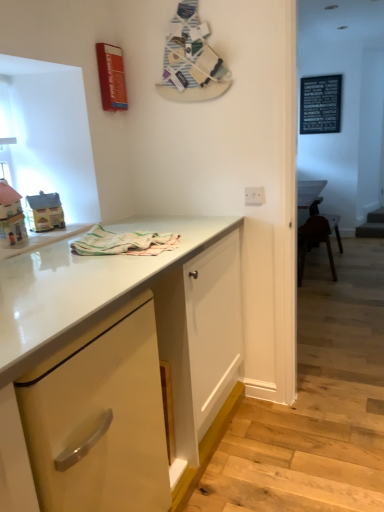
Question: Is matte yellow cabinet at center, the second cabinetry when ordered from back to front, completely or partially inside matte yellow house at left, the 2th toy positioned from the front?

Choices:
 (A) yes
 (B) no

Answer: (B)

Question: Is matte yellow cabinet at center, the second cabinetry when ordered from back to front, at the back of matte yellow house at left, the first toy from the back?

Choices:
 (A) no
 (B) yes

Answer: (A)

Question: Is matte yellow house at left, the 2th toy positioned from the front, far away from matte yellow cabinet at center, which is the first cabinetry from front to back?

Choices:
 (A) yes
 (B) no

Answer: (B)

Question: Does matte yellow house at left, the first toy from the back, have a greater height compared to matte yellow cabinet at center, which is the first cabinetry from front to back?

Choices:
 (A) yes
 (B) no

Answer: (B)

Question: Can you confirm if matte yellow house at left, the 2th toy positioned from the front, is positioned to the left of matte yellow cabinet at center, the second cabinetry when ordered from back to front?

Choices:
 (A) no
 (B) yes

Answer: (B)

Question: In the image, is white glossy electric outlet at upper center positioned in front of or behind matte yellow toy house at left, placed as the first toy when sorted from front to back?

Choices:
 (A) front
 (B) behind

Answer: (B)

Question: Considering the positions of white glossy electric outlet at upper center and matte yellow toy house at left, which is the second toy from back to front, in the image, is white glossy electric outlet at upper center taller or shorter than matte yellow toy house at left, which is the second toy from back to front,?

Choices:
 (A) short
 (B) tall

Answer: (A)

Question: Considering the positions of white glossy electric outlet at upper center and matte yellow toy house at left, placed as the first toy when sorted from front to back, in the image, is white glossy electric outlet at upper center wider or thinner than matte yellow toy house at left, placed as the first toy when sorted from front to back,?

Choices:
 (A) wide
 (B) thin

Answer: (B)

Question: In terms of size, does white glossy electric outlet at upper center appear bigger or smaller than matte yellow toy house at left, placed as the first toy when sorted from front to back?

Choices:
 (A) big
 (B) small

Answer: (B)

Question: In terms of size, does matte yellow toy house at left, which is the second toy from back to front, appear bigger or smaller than pastel striped cloth at center?

Choices:
 (A) big
 (B) small

Answer: (B)

Question: Considering their positions, is matte yellow toy house at left, placed as the first toy when sorted from front to back, located in front of or behind pastel striped cloth at center?

Choices:
 (A) behind
 (B) front

Answer: (A)

Question: In terms of width, does matte yellow toy house at left, which is the second toy from back to front, look wider or thinner when compared to pastel striped cloth at center?

Choices:
 (A) wide
 (B) thin

Answer: (B)

Question: From the image's perspective, relative to pastel striped cloth at center, is matte yellow toy house at left, placed as the first toy when sorted from front to back, above or below?

Choices:
 (A) above
 (B) below

Answer: (A)

Question: Looking at their shapes, would you say pastel striped cloth at center is wider or thinner than matte yellow house at left, the 2th toy positioned from the front?

Choices:
 (A) thin
 (B) wide

Answer: (B)

Question: Choose the correct answer: Is pastel striped cloth at center inside matte yellow house at left, the first toy from the back, or outside it?

Choices:
 (A) outside
 (B) inside

Answer: (A)